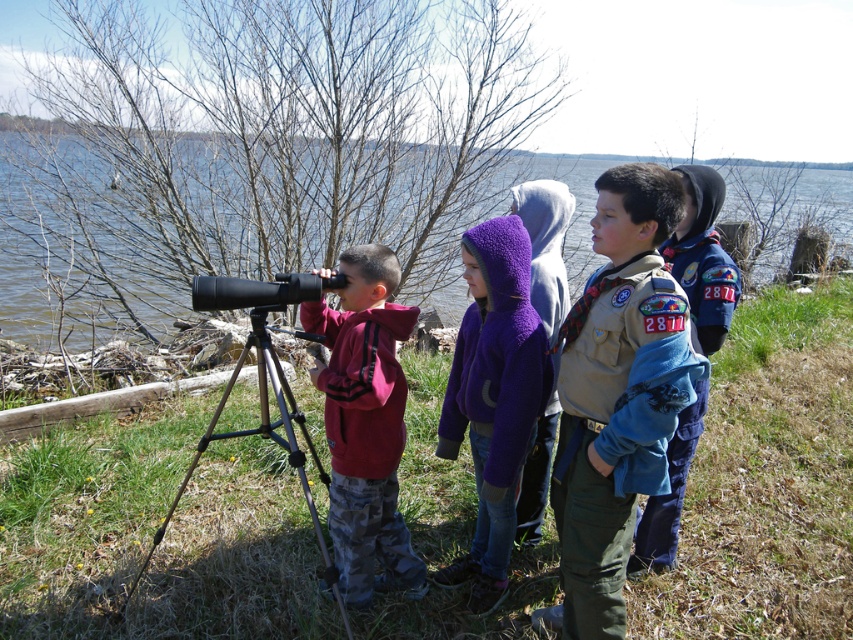
Between clear blue water at center and black metal tripod at lower left, which one has less height?

With less height is black metal tripod at lower left.

Which is above, clear blue water at center or black metal tripod at lower left?

clear blue water at center is above.

Is point (148, 316) behind point (300, 332)?

Yes, it is behind point (300, 332).

Locate an element on the screen. clear blue water at center is located at coordinates (19, 262).

Can you confirm if matte red hoodie at center is smaller than blue fleece jacket at center?

Yes.

Which is above, matte red hoodie at center or blue fleece jacket at center?

Positioned higher is blue fleece jacket at center.

Where is `matte red hoodie at center`? Image resolution: width=853 pixels, height=640 pixels. matte red hoodie at center is located at coordinates coord(364,422).

Can you confirm if khaki uniform at center is shorter than black metal tripod at lower left?

Incorrect, khaki uniform at center's height does not fall short of black metal tripod at lower left's.

Which is above, khaki uniform at center or black metal tripod at lower left?

khaki uniform at center is above.

What do you see at coordinates (618, 396) in the screenshot? I see `khaki uniform at center` at bounding box center [618, 396].

This screenshot has width=853, height=640. What are the coordinates of `khaki uniform at center` in the screenshot? It's located at (618, 396).